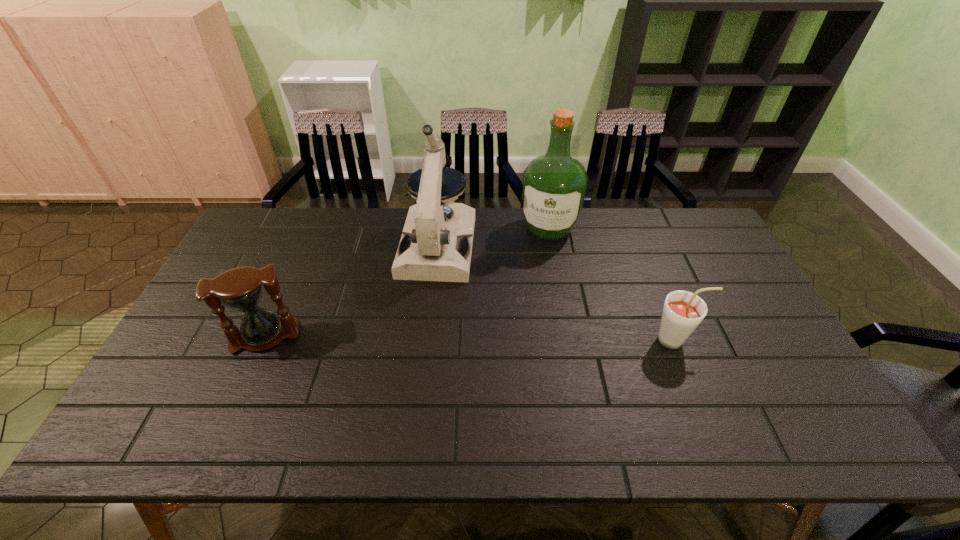
Locate an element on the screen. The image size is (960, 540). hourglass is located at coordinates (241, 288).

The image size is (960, 540). Identify the location of the leftmost object. (241, 288).

Image resolution: width=960 pixels, height=540 pixels. Find the location of `root beer`. root beer is located at coordinates (683, 311).

The image size is (960, 540). I want to click on the shortest object, so click(x=683, y=311).

Find the location of a particular element. The image size is (960, 540). microscope is located at coordinates (430, 249).

Where is `liquor`? liquor is located at coordinates (554, 185).

This screenshot has width=960, height=540. I want to click on vacant space positioned on the back of the hourglass, so click(312, 231).

You are a GUI agent. You are given a task and a screenshot of the screen. Output one action in this format:
    pyautogui.click(x=<x>, y=<y>)
    Task: Click on the free spot located on the drink side of the shortest object
    The image size is (960, 540).
    Given the screenshot: What is the action you would take?
    pyautogui.click(x=737, y=340)

The image size is (960, 540). I want to click on free space located at the eyepiece of the microscope, so click(418, 352).

This screenshot has width=960, height=540. I want to click on free space located at the eyepiece of the microscope, so click(x=423, y=323).